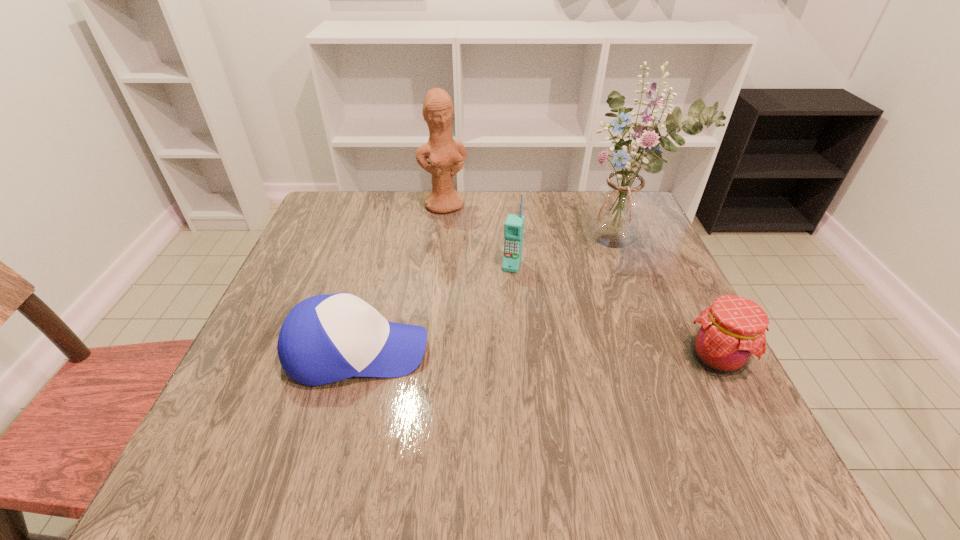
Find the location of `blank area at the near right corner`. blank area at the near right corner is located at coordinates (686, 419).

Identify the location of empty space that is in between the baseball cap and the jam. (537, 355).

This screenshot has height=540, width=960. What are the coordinates of `free spot between the tallest object and the baseball cap` in the screenshot? It's located at (488, 297).

At what (x,y) coordinates should I click in order to perform the action: click on vacant space in between the jam and the third object from left to right. Please return your answer as a coordinate pair (x, y). This screenshot has height=540, width=960. Looking at the image, I should click on (614, 312).

Find the location of a particular element. vacant region between the baseball cap and the jam is located at coordinates (537, 355).

Locate an element on the screen. This screenshot has width=960, height=540. free spot between the third object from right to left and the jam is located at coordinates (x=614, y=312).

Locate an element on the screen. free space between the figurine and the tallest object is located at coordinates pyautogui.click(x=531, y=224).

This screenshot has height=540, width=960. Find the location of `vacant area between the bouquet and the baseball cap`. vacant area between the bouquet and the baseball cap is located at coordinates pos(488,297).

Identify the location of unoccupied position between the baseball cap and the bouquet. The width and height of the screenshot is (960, 540). (488, 297).

Where is `vacant point located between the bouquet and the second tallest object`? The height and width of the screenshot is (540, 960). vacant point located between the bouquet and the second tallest object is located at coordinates (531, 224).